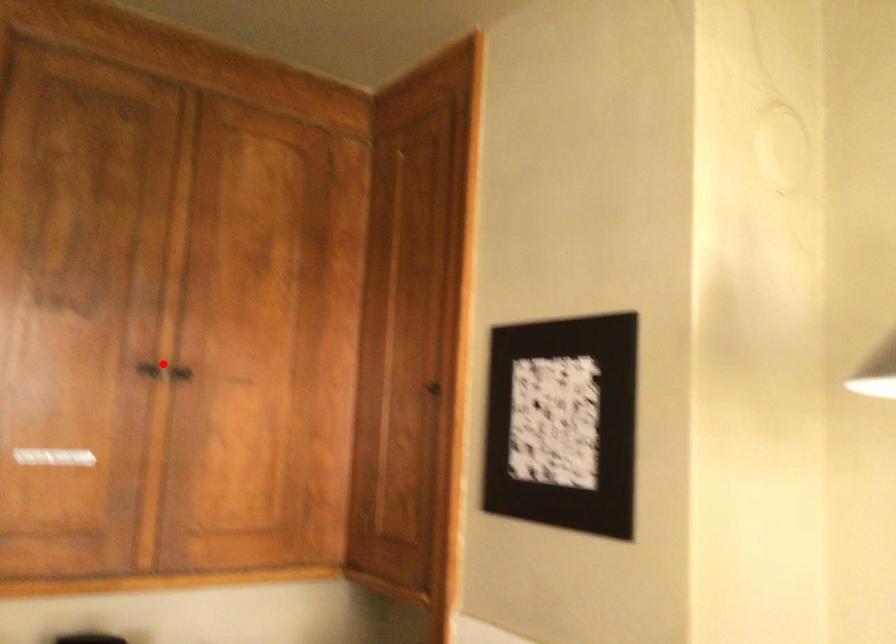
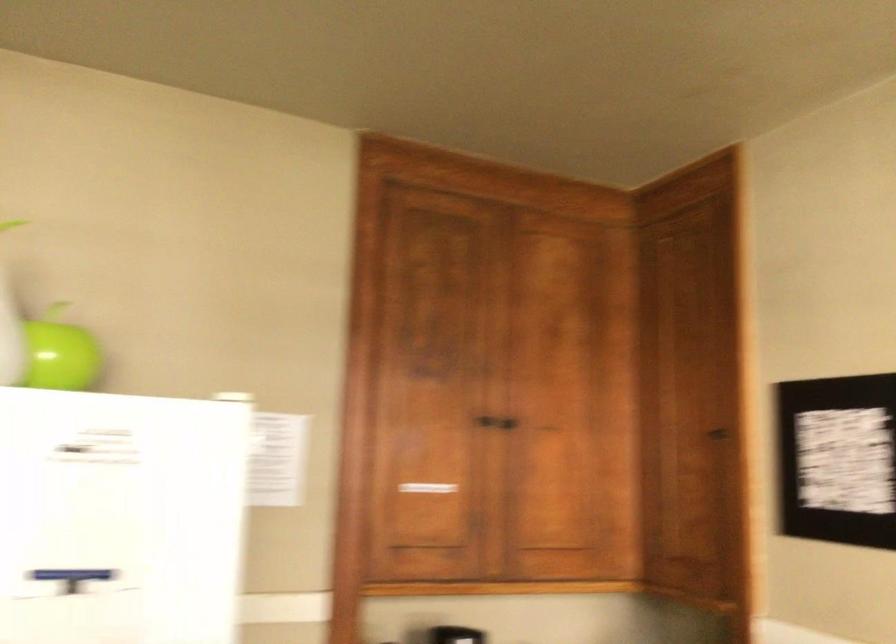
Find the pixel in the second image that matches the highlighted location in the first image.

(485, 420)